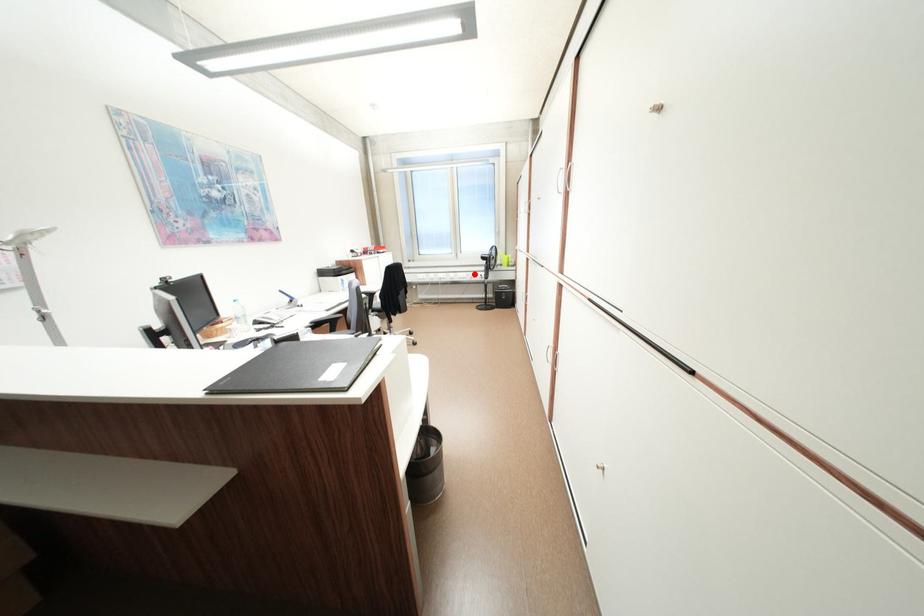
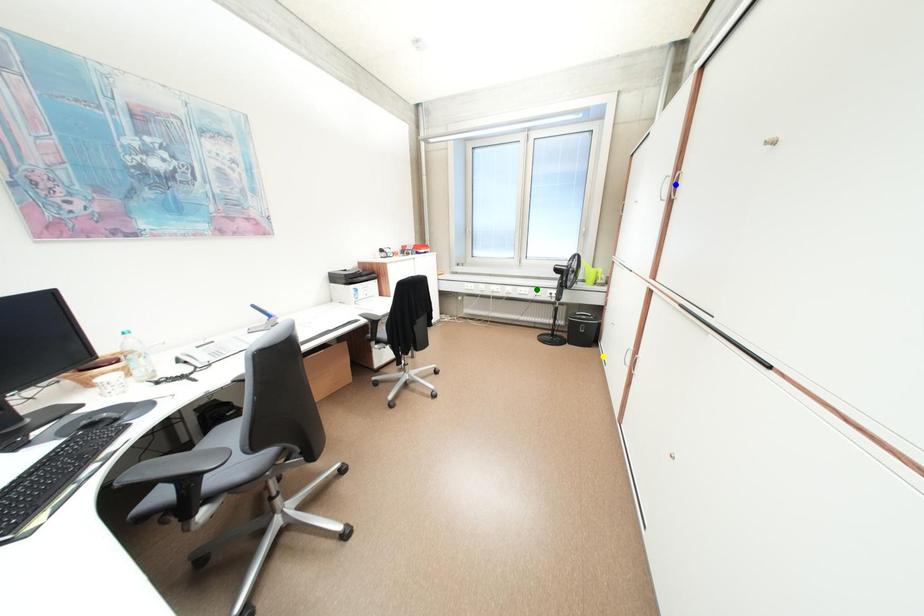
Question: I am providing you with two images of the same scene from different viewpoints. A red point is marked on the first image. You are given multiple points on the second image. Which spot in image 2 lines up with the point in image 1?

Choices:
 (A) blue point
 (B) green point
 (C) yellow point

Answer: (B)